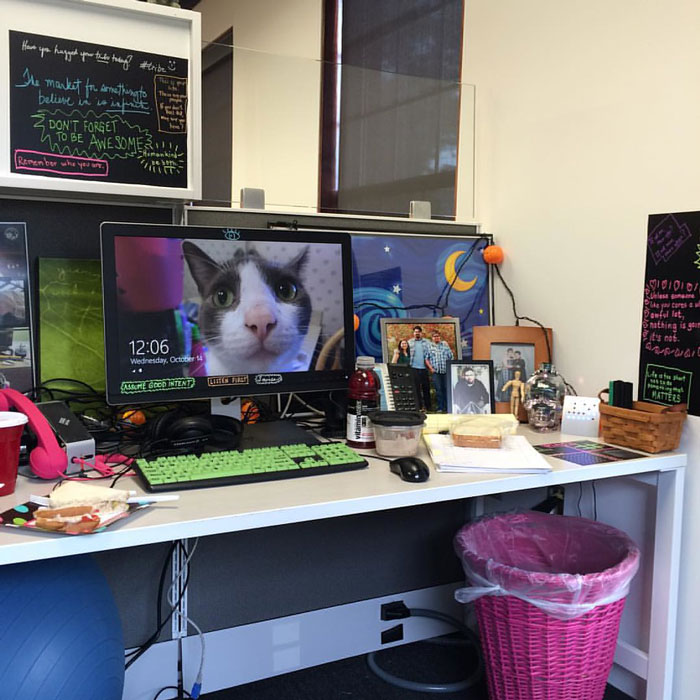
Locate an element on the screen. pink trash bin is located at coordinates (584, 624).